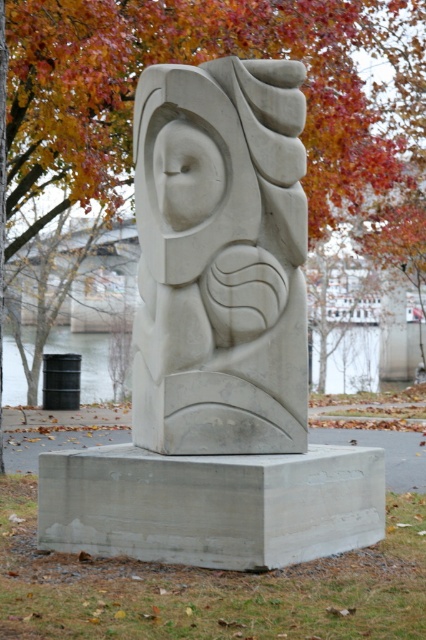
You are an artist planning to sketch this sculpture. You notice the white stone owl at center and the orange leafy tree at upper center. Which object should you draw first if you want to focus on the larger one in terms of width?

The white stone owl at center has a larger width than the orange leafy tree at upper center, so you should draw the white stone owl at center first.